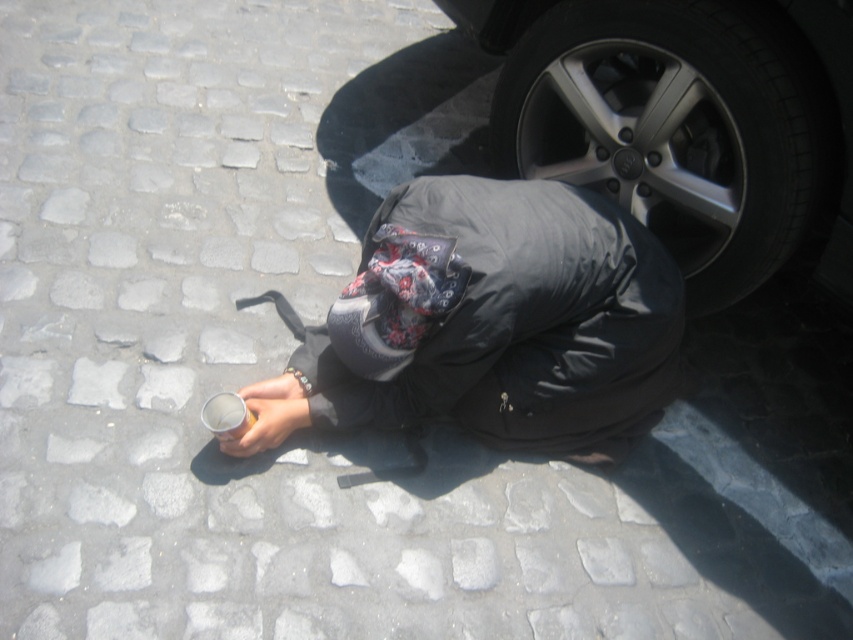
You are a delivery person trying to navigate through the cobblestone street. There is a metallic can at center and a silver metallic tire at lower right. Which object is closer to you as you approach the street?

The metallic can at center is closer to you than the silver metallic tire at lower right because it is positioned in front of it.

You are standing at the camera position and see the point marked as point (x=498, y=272). If you want to place a 4 feet wide signboard on the ground at that point, will it fit without overlapping the cobblestone street?

The point (x=498, y=272) is 5.18 feet from the camera. Since the signboard is 4 feet wide, it will fit at that location without overlapping the cobblestone street as there is enough space available.